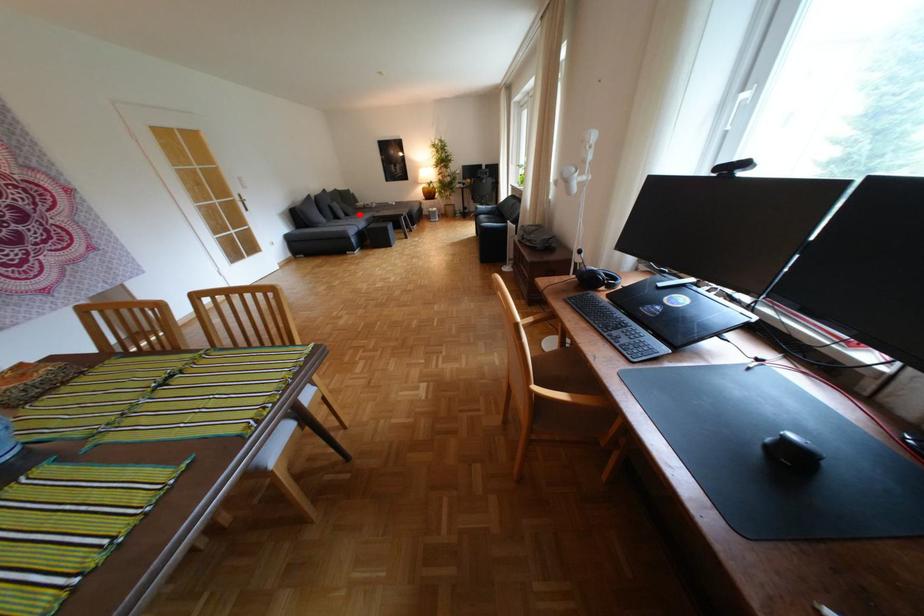
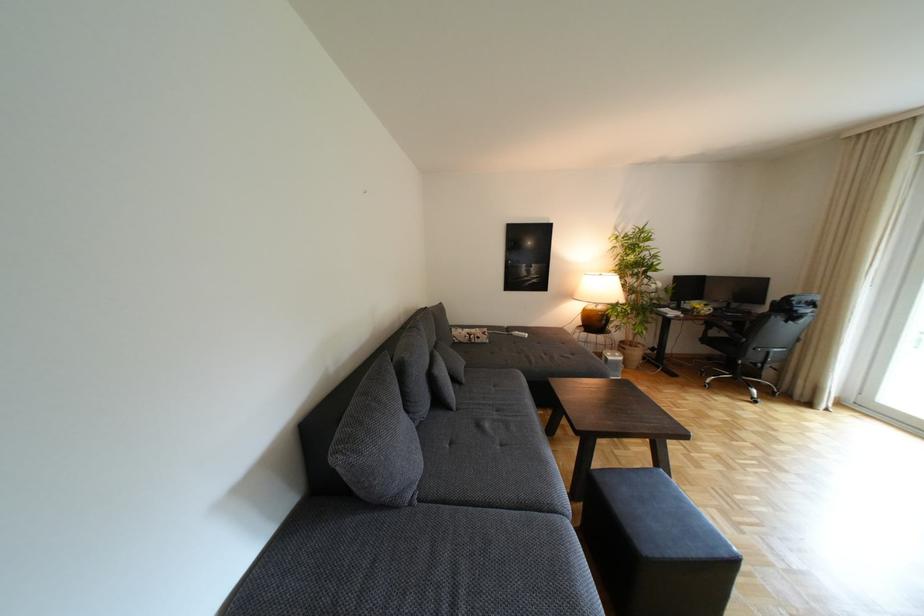
Where in the second image is the point corresponding to the highlighted location from the first image?

(468, 379)